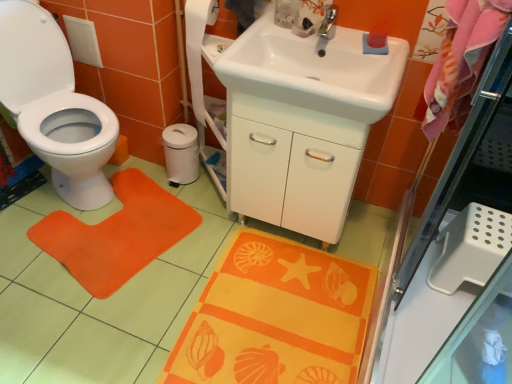
Where is `free space to the right of silver metallic faucet at upper center`? free space to the right of silver metallic faucet at upper center is located at coordinates (352, 47).